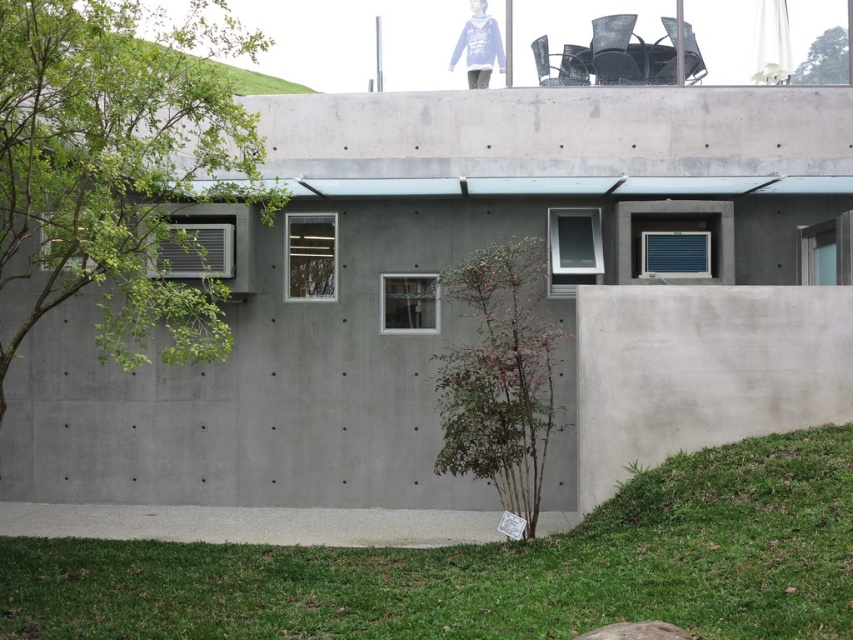
Question: Is green leafy tree at left above smooth concrete wall at lower right?

Choices:
 (A) yes
 (B) no

Answer: (A)

Question: Can you confirm if green leafy tree at left is positioned below green matte tree at center?

Choices:
 (A) yes
 (B) no

Answer: (B)

Question: Which is farther from the gray concrete at lower center?

Choices:
 (A) green leafy tree at upper right
 (B) gray concrete wall at center

Answer: (A)

Question: Which is farther from the smooth concrete wall at lower right?

Choices:
 (A) green leafy tree at upper right
 (B) green matte tree at center
 (C) green grass at lower center
 (D) gray concrete wall at center

Answer: (D)

Question: Estimate the real-world distances between objects in this image. Which object is closer to the smooth concrete wall at lower right?

Choices:
 (A) green grass at lower center
 (B) green matte tree at center
 (C) gray concrete at lower center

Answer: (B)

Question: Does green grass at lower center appear on the right side of green matte tree at center?

Choices:
 (A) no
 (B) yes

Answer: (A)